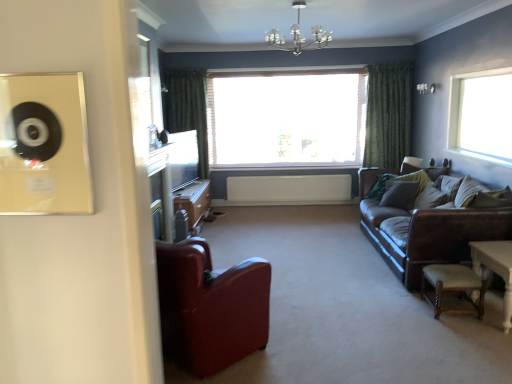
This screenshot has width=512, height=384. I want to click on free space to the right of leather armchair at lower left, so click(x=298, y=343).